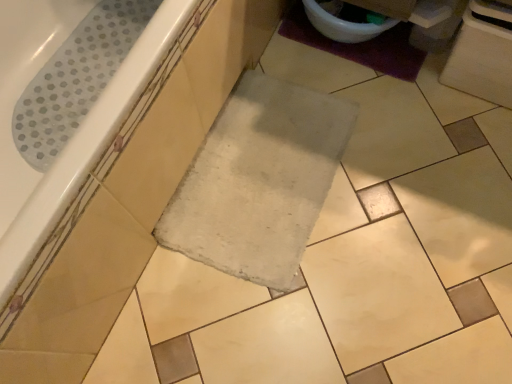
The image size is (512, 384). I want to click on white glossy toilet bowl at upper right, so click(x=343, y=25).

Identify the location of purple fuzzy bath mat at upper right. (361, 46).

At what (x,y) coordinates should I click in order to perform the action: click on white glossy bathtub at upper left. Please return your answer as a coordinate pair (x, y). This screenshot has width=512, height=384. Looking at the image, I should click on (85, 147).

You are a GUI agent. You are given a task and a screenshot of the screen. Output one action in this format:
    pyautogui.click(x=<x>, y=<y>)
    Task: Click on the white glossy toilet bowl at upper right
    This screenshot has width=512, height=384.
    Given the screenshot: What is the action you would take?
    pyautogui.click(x=343, y=25)

Is purple fuzzy bath mat at upper right far away from white glossy toilet bowl at upper right?

No.

Between purple fuzzy bath mat at upper right and white glossy toilet bowl at upper right, which one appears on the left side from the viewer's perspective?

From the viewer's perspective, white glossy toilet bowl at upper right appears more on the left side.

Is purple fuzzy bath mat at upper right not inside white glossy toilet bowl at upper right?

That's correct, purple fuzzy bath mat at upper right is outside of white glossy toilet bowl at upper right.

Measure the distance from purple fuzzy bath mat at upper right to white glossy toilet bowl at upper right.

purple fuzzy bath mat at upper right and white glossy toilet bowl at upper right are 8.88 centimeters apart.

Considering the relative sizes of white glossy bathtub at upper left and white glossy toilet bowl at upper right in the image provided, is white glossy bathtub at upper left thinner than white glossy toilet bowl at upper right?

No, white glossy bathtub at upper left is not thinner than white glossy toilet bowl at upper right.

Is white glossy bathtub at upper left positioned before white glossy toilet bowl at upper right?

Yes.

Considering the relative sizes of white glossy bathtub at upper left and white glossy toilet bowl at upper right in the image provided, is white glossy bathtub at upper left shorter than white glossy toilet bowl at upper right?

In fact, white glossy bathtub at upper left may be taller than white glossy toilet bowl at upper right.

From the image's perspective, is white glossy bathtub at upper left positioned above or below white glossy toilet bowl at upper right?

Clearly, from the image's perspective, white glossy bathtub at upper left is below white glossy toilet bowl at upper right.

Is white glossy bathtub at upper left at the left side of purple fuzzy bath mat at upper right?

Yes.

Is point (55, 198) closer or farther from the camera than point (321, 41)?

Point (55, 198) is positioned closer to the camera compared to point (321, 41).

Looking at this image, does white glossy bathtub at upper left turn towards purple fuzzy bath mat at upper right?

Yes, white glossy bathtub at upper left is aimed at purple fuzzy bath mat at upper right.

Considering the positions of objects white glossy bathtub at upper left and purple fuzzy bath mat at upper right in the image provided, who is in front, white glossy bathtub at upper left or purple fuzzy bath mat at upper right?

white glossy bathtub at upper left is closer to the camera.

Does purple fuzzy bath mat at upper right contain white glossy bathtub at upper left?

Definitely not — white glossy bathtub at upper left is not inside purple fuzzy bath mat at upper right.

From the image's perspective, is purple fuzzy bath mat at upper right located above white glossy bathtub at upper left?

Yes, from the image's perspective, purple fuzzy bath mat at upper right is on top of white glossy bathtub at upper left.

Can you tell me how much purple fuzzy bath mat at upper right and white glossy bathtub at upper left differ in facing direction?

purple fuzzy bath mat at upper right and white glossy bathtub at upper left are facing 90 degrees away from each other.

Considering the positions of point (355, 29) and point (22, 209), is point (355, 29) closer or farther from the camera than point (22, 209)?

Point (355, 29).

From a real-world perspective, between white glossy toilet bowl at upper right and white glossy bathtub at upper left, who is vertically lower?

white glossy toilet bowl at upper right.

Between white glossy toilet bowl at upper right and purple fuzzy bath mat at upper right, which one has smaller width?

white glossy toilet bowl at upper right is thinner.

Based on the photo, from the image's perspective, which object appears higher, white glossy toilet bowl at upper right or purple fuzzy bath mat at upper right?

white glossy toilet bowl at upper right, from the image's perspective.

Is white glossy toilet bowl at upper right positioned with its back to purple fuzzy bath mat at upper right?

white glossy toilet bowl at upper right is not turned away from purple fuzzy bath mat at upper right.

Image resolution: width=512 pixels, height=384 pixels. There is a purple fuzzy bath mat at upper right. What are the coordinates of `toilet bowl above it (from a real-world perspective)` in the screenshot? It's located at (343, 25).

You are a GUI agent. You are given a task and a screenshot of the screen. Output one action in this format:
    pyautogui.click(x=<x>, y=<y>)
    Task: Click on the toilet bowl lying behind the white glossy bathtub at upper left
    This screenshot has height=384, width=512.
    Given the screenshot: What is the action you would take?
    pyautogui.click(x=343, y=25)

Which object lies further to the anchor point white glossy bathtub at upper left, purple fuzzy bath mat at upper right or white glossy toilet bowl at upper right?

purple fuzzy bath mat at upper right is positioned further to the anchor white glossy bathtub at upper left.

Which object lies further to the anchor point white glossy bathtub at upper left, white glossy toilet bowl at upper right or purple fuzzy bath mat at upper right?

purple fuzzy bath mat at upper right is positioned further to the anchor white glossy bathtub at upper left.

When comparing their distances from purple fuzzy bath mat at upper right, does white glossy bathtub at upper left or white glossy toilet bowl at upper right seem closer?

white glossy toilet bowl at upper right is positioned closer to the anchor purple fuzzy bath mat at upper right.

Estimate the real-world distances between objects in this image. Which object is closer to white glossy toilet bowl at upper right, purple fuzzy bath mat at upper right or white glossy bathtub at upper left?

purple fuzzy bath mat at upper right lies closer to white glossy toilet bowl at upper right than the other object.

From the image, which object appears to be farther from purple fuzzy bath mat at upper right, white glossy toilet bowl at upper right or white glossy bathtub at upper left?

white glossy bathtub at upper left lies further to purple fuzzy bath mat at upper right than the other object.

From the image, which object appears to be farther from white glossy toilet bowl at upper right, white glossy bathtub at upper left or purple fuzzy bath mat at upper right?

white glossy bathtub at upper left is further to white glossy toilet bowl at upper right.

In order to click on toilet bowl between white glossy bathtub at upper left and purple fuzzy bath mat at upper right in this screenshot , I will do `click(343, 25)`.